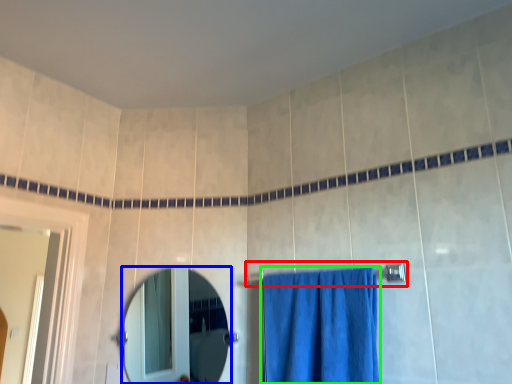
Question: Which object is positioned closest to towel bar (highlighted by a red box)? Select from mirror (highlighted by a blue box) and curtain (highlighted by a green box).

Choices:
 (A) mirror
 (B) curtain

Answer: (B)